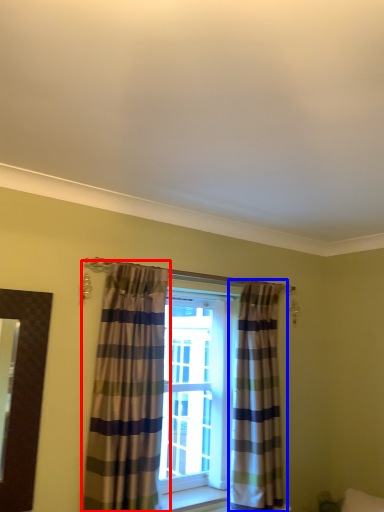
Question: Which object appears closest to the camera in this image, curtain (highlighted by a red box) or curtain (highlighted by a blue box)?

Choices:
 (A) curtain
 (B) curtain

Answer: (A)